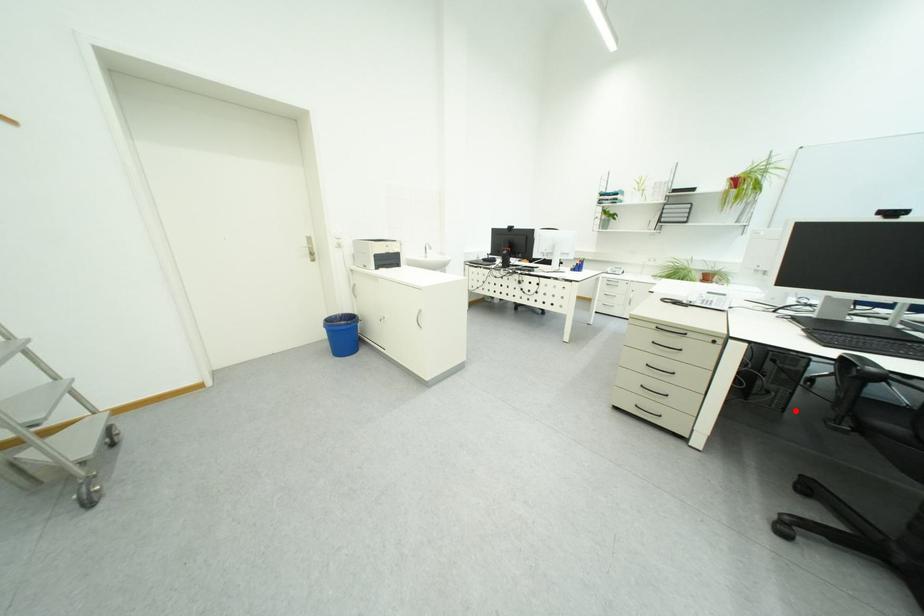
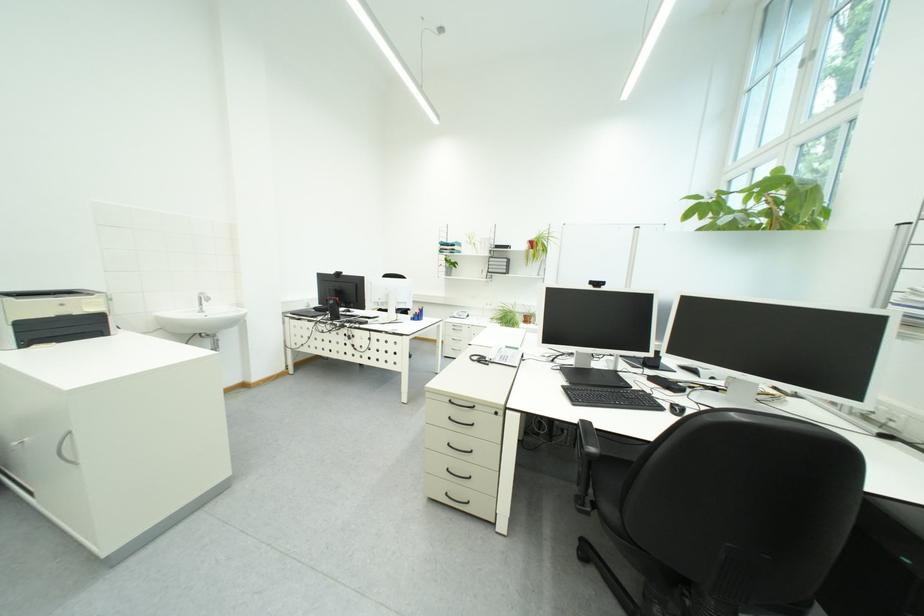
The point at the highlighted location is marked in the first image. Where is the corresponding point in the second image?

(586, 446)